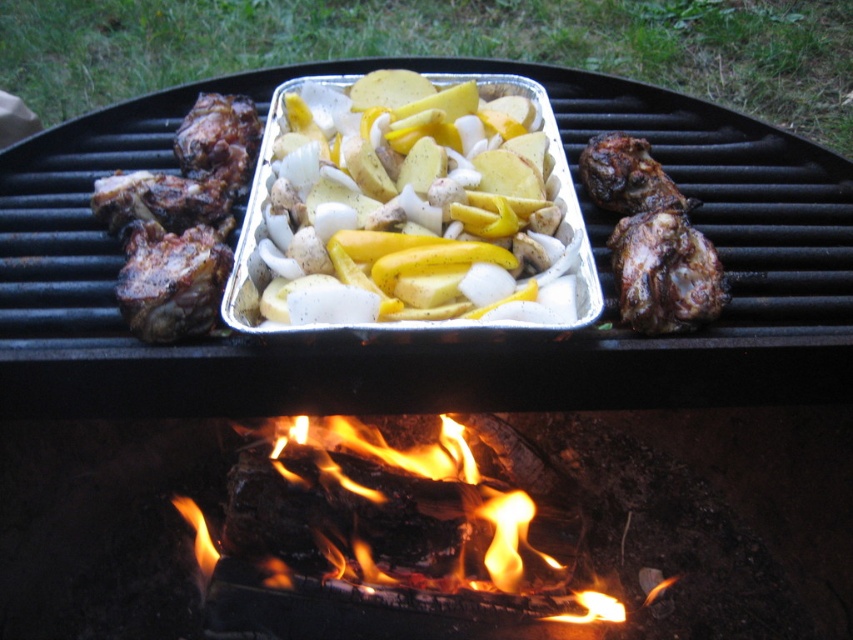
Based on the photo, is yellow matte potatoes at center thinner than brown crispy bone-in meat at left?

Incorrect, yellow matte potatoes at center's width is not less than brown crispy bone-in meat at left's.

The height and width of the screenshot is (640, 853). Describe the element at coordinates (398, 205) in the screenshot. I see `yellow matte potatoes at center` at that location.

Is point (434, 209) behind point (173, 148)?

No, (434, 209) is closer to viewer.

Identify the location of yellow matte potatoes at center. Image resolution: width=853 pixels, height=640 pixels. click(x=398, y=205).

In the scene shown: Is yellow matte potatoes at center smaller than flamewood at center?

Indeed, yellow matte potatoes at center has a smaller size compared to flamewood at center.

Where is `yellow matte potatoes at center`? Image resolution: width=853 pixels, height=640 pixels. yellow matte potatoes at center is located at coordinates (398, 205).

What do you see at coordinates (181, 220) in the screenshot?
I see `brown crispy bone-in meat at left` at bounding box center [181, 220].

Which is in front, point (229, 173) or point (364, 576)?

Point (229, 173)

At what (x,y) coordinates should I click in order to perform the action: click on brown crispy bone-in meat at left. Please return your answer as a coordinate pair (x, y). Looking at the image, I should click on (181, 220).